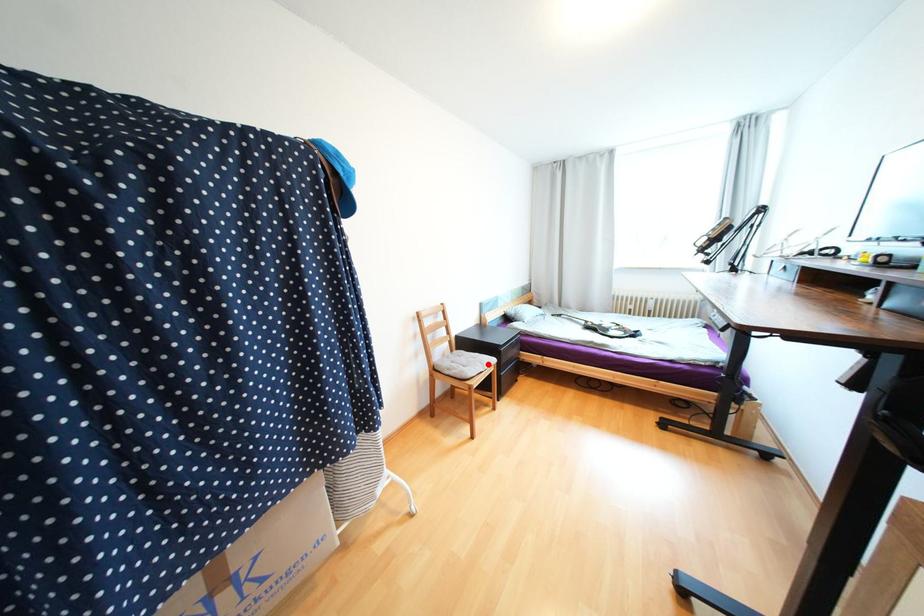
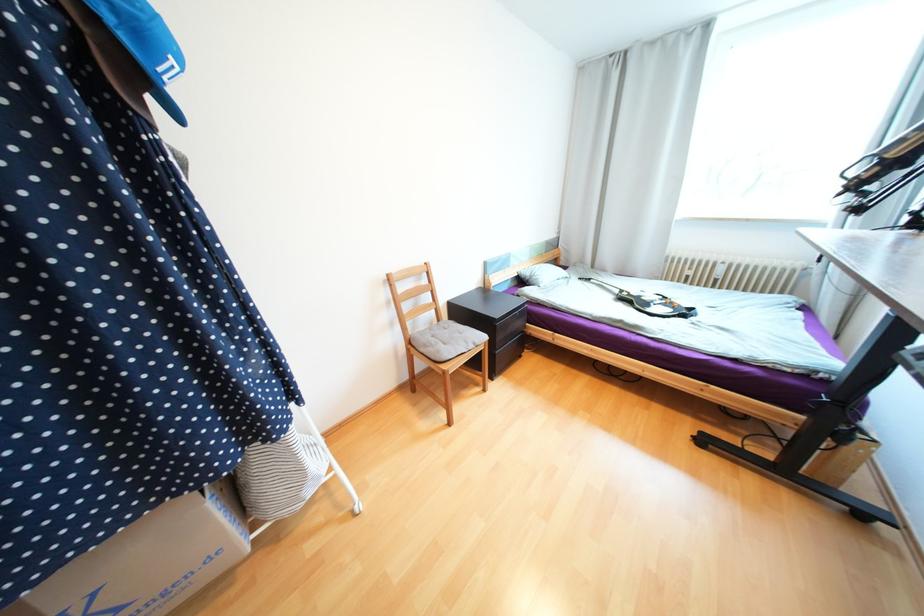
Question: I am providing you with two images of the same scene from different viewpoints. A red point is marked on the first image. Is the red point's position out of view in image 2?

Choices:
 (A) Yes
 (B) No

Answer: (B)